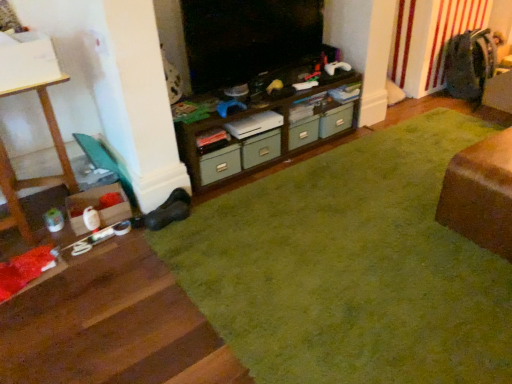
This screenshot has width=512, height=384. I want to click on unoccupied area in front of green fabric drawer at center, the first drawer positioned from the front, so click(x=267, y=181).